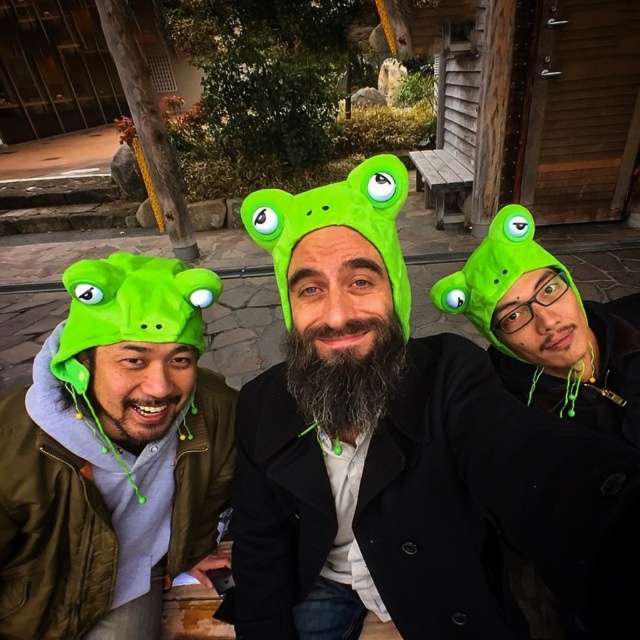
Question: Which object is the closest to the green matte frog hat at left?

Choices:
 (A) green matte frog hat at center
 (B) matte green frog hat at left

Answer: (B)

Question: Does green matte frog hat at center have a larger size compared to green matte frog hat at left?

Choices:
 (A) yes
 (B) no

Answer: (A)

Question: Which object is closer to the camera taking this photo?

Choices:
 (A) matte green frog hat at left
 (B) green matte frog hat at center

Answer: (B)

Question: Does green matte frog hat at left have a lesser width compared to matte green frog hat at left?

Choices:
 (A) yes
 (B) no

Answer: (B)

Question: Does green matte frog hat at center have a larger size compared to green matte frog hat at left?

Choices:
 (A) no
 (B) yes

Answer: (B)

Question: Estimate the real-world distances between objects in this image. Which object is farther from the green matte frog hat at center?

Choices:
 (A) green matte frog hat at left
 (B) matte green frog hat at left

Answer: (B)